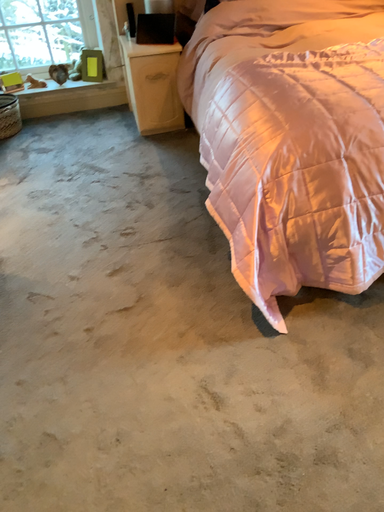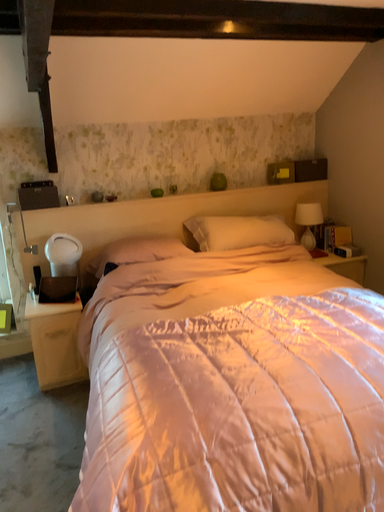
Question: Which way did the camera rotate in the video?

Choices:
 (A) rotated downward
 (B) rotated upward

Answer: (B)